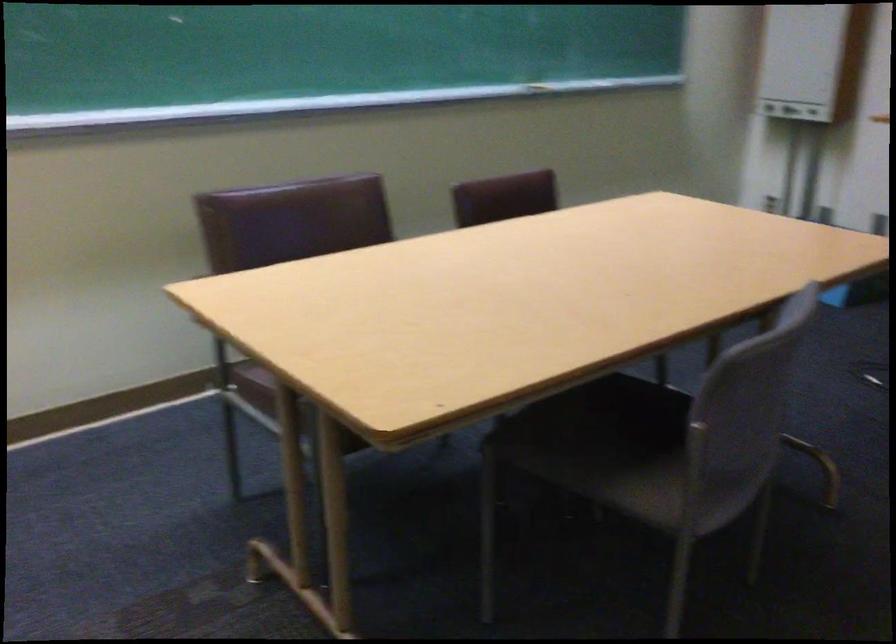
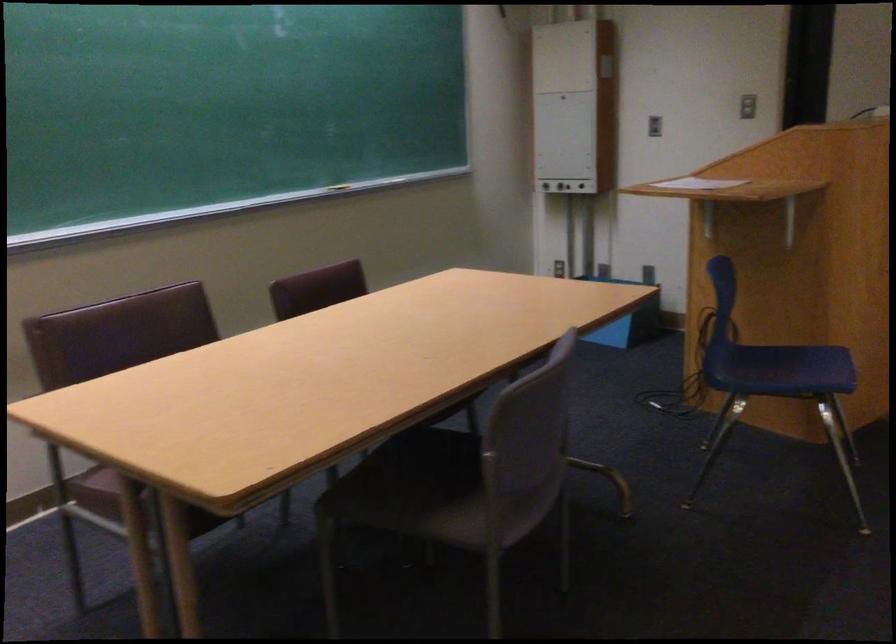
In the second image, find the point that corresponds to (x=245, y=384) in the first image.

(96, 491)